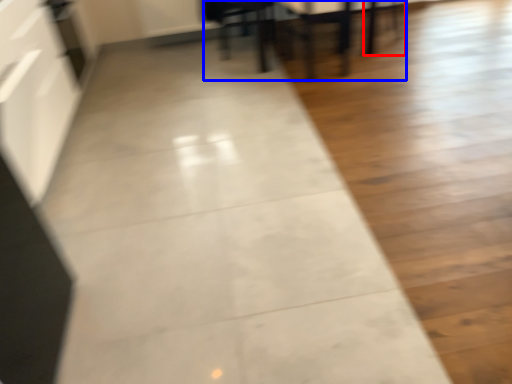
Question: Which point is closer to the camera, chair (highlighted by a red box) or table (highlighted by a blue box)?

Choices:
 (A) chair
 (B) table

Answer: (B)